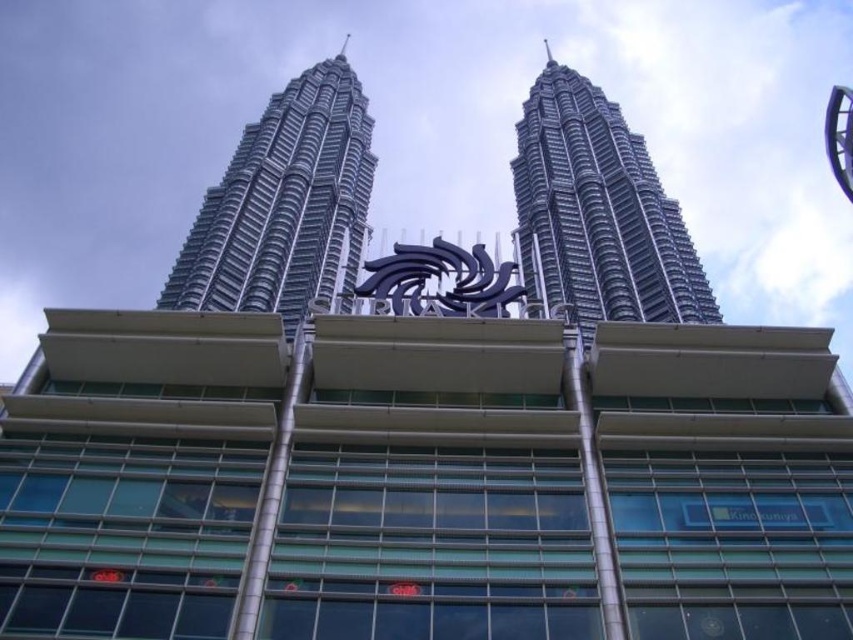
Question: Can you confirm if silver metallic skyscraper at upper left is positioned below silver metallic tower at center?

Choices:
 (A) yes
 (B) no

Answer: (A)

Question: Which point is closer to the camera taking this photo?

Choices:
 (A) (675, 289)
 (B) (230, 259)

Answer: (A)

Question: Among these objects, which one is farthest from the camera?

Choices:
 (A) silver metallic skyscraper at upper left
 (B) silver metallic tower at center

Answer: (B)

Question: Which point is closer to the camera taking this photo?

Choices:
 (A) (683, 278)
 (B) (318, 84)

Answer: (A)

Question: Considering the relative positions of silver metallic skyscraper at upper left and silver metallic tower at center in the image provided, where is silver metallic skyscraper at upper left located with respect to silver metallic tower at center?

Choices:
 (A) below
 (B) above

Answer: (A)

Question: Is silver metallic skyscraper at upper left behind silver metallic tower at center?

Choices:
 (A) yes
 (B) no

Answer: (B)